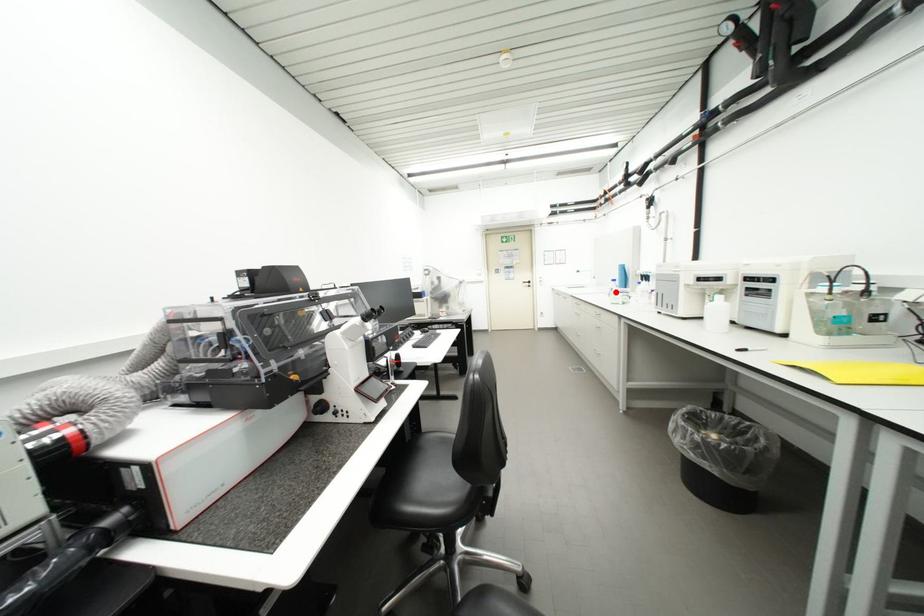
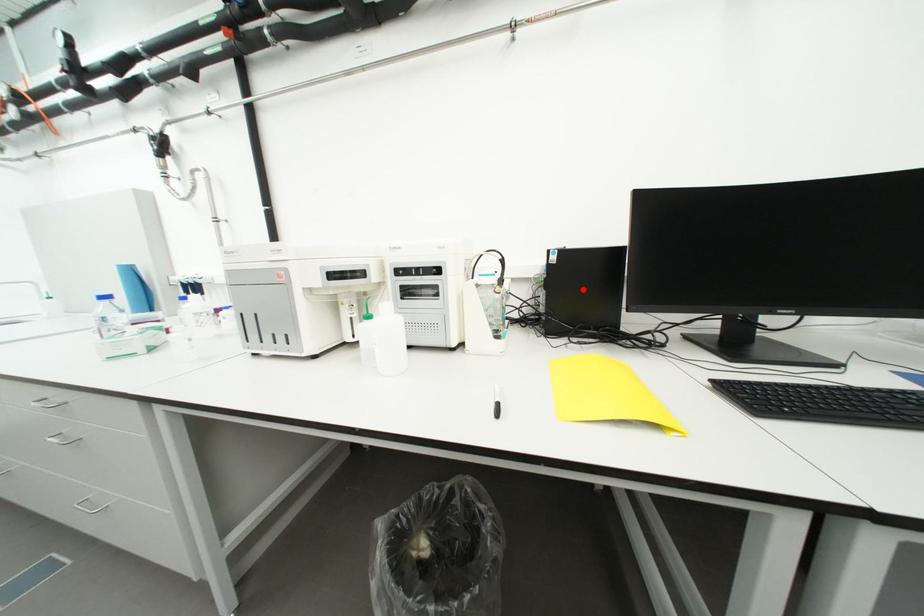
I am providing you with two images of the same scene from different viewpoints. A red point is marked on the first image and another point is marked on the second image. Is the marked point in image1 the same physical position as the marked point in image2?

No